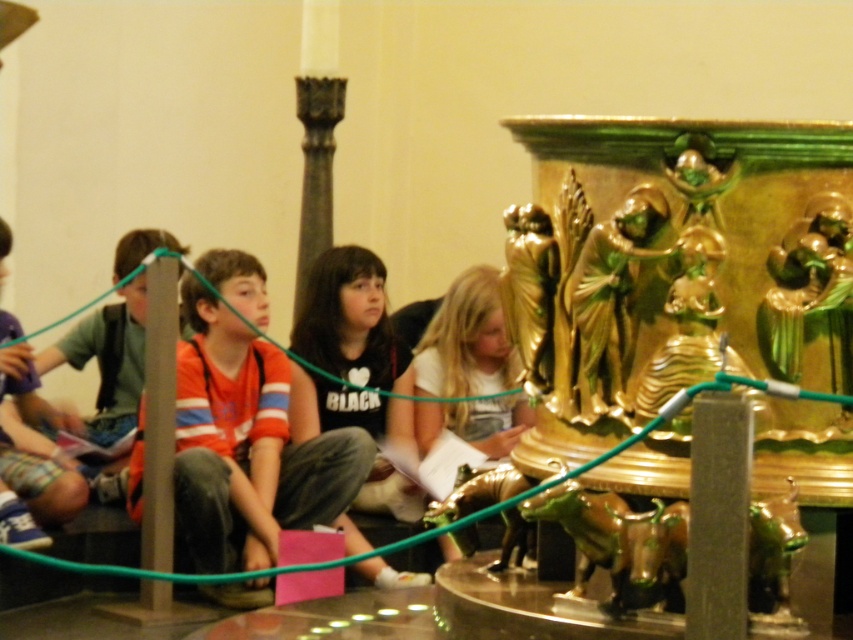
You are a tour guide in the museum and need to ensure all visitors are positioned safely behind the green rope barrier. You notice the white matte shirt at center and the matte green backpack at left. Which visitor is closer to the artifact?

The white matte shirt at center is closer to the artifact because it is in front of the matte green backpack at left.